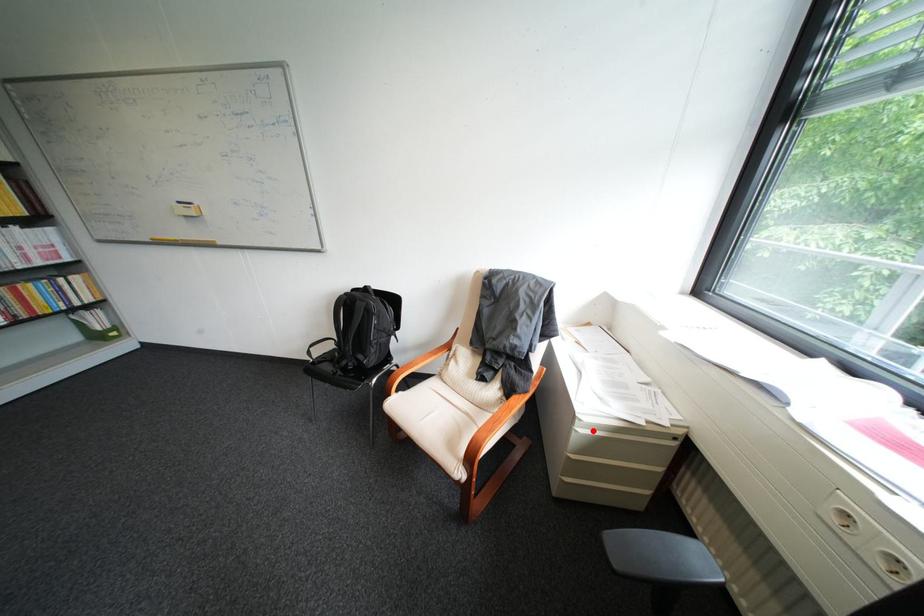
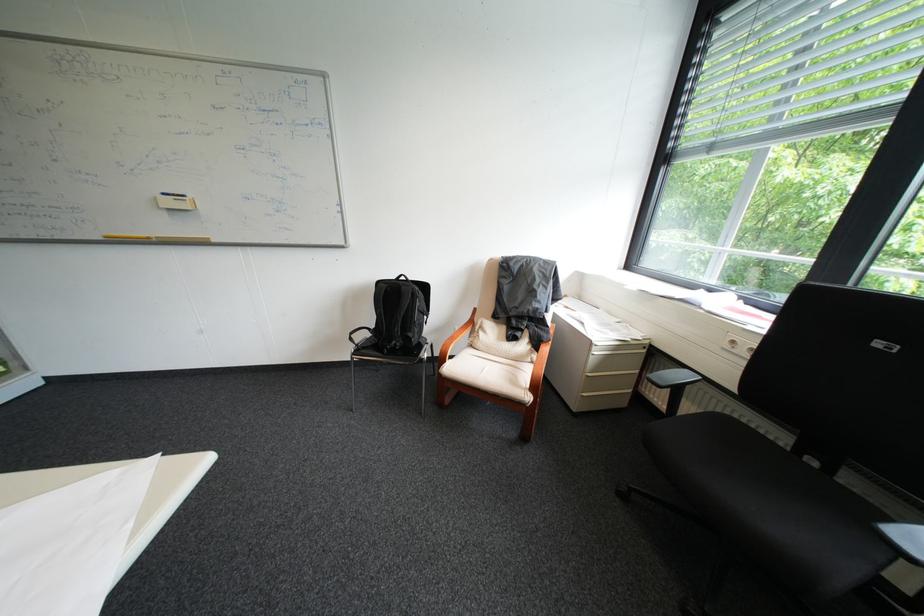
Where in the second image is the point corresponding to the highlighted location from the first image?

(609, 353)